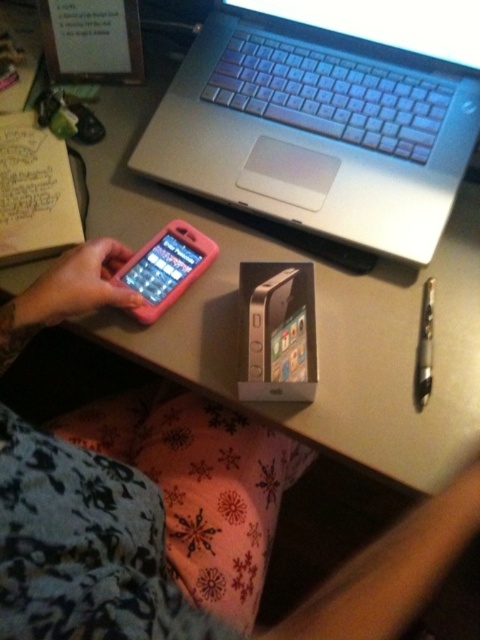
You are organizing items on a desk and need to place the silver metallic ipod at center and the pink matte smartphone at center. According to their positions, which item is closer to the bottom edge of the desk?

The silver metallic ipod at center is closer to the bottom edge of the desk because it is positioned below the pink matte smartphone at center.

You are organizing items on a desk and want to place the silver metallic laptop at center and the metallic pen at right next to each other. Which item requires more horizontal space to fit properly?

The silver metallic laptop at center requires more horizontal space because its width surpasses that of the metallic pen at right.

In the scene shown: You are organizing items on a desk and need to place a metallic pen at right. Where should you place it relative to the silver metallic laptop at center?

The silver metallic laptop at center is above the metallic pen at right, so you should place the metallic pen at right below the silver metallic laptop at center.